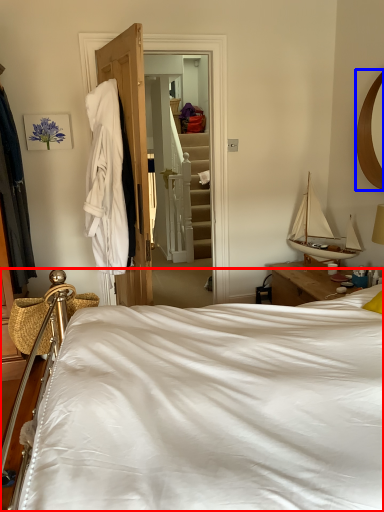
Question: Which point is further to the camera, bed (highlighted by a red box) or mirror (highlighted by a blue box)?

Choices:
 (A) bed
 (B) mirror

Answer: (B)